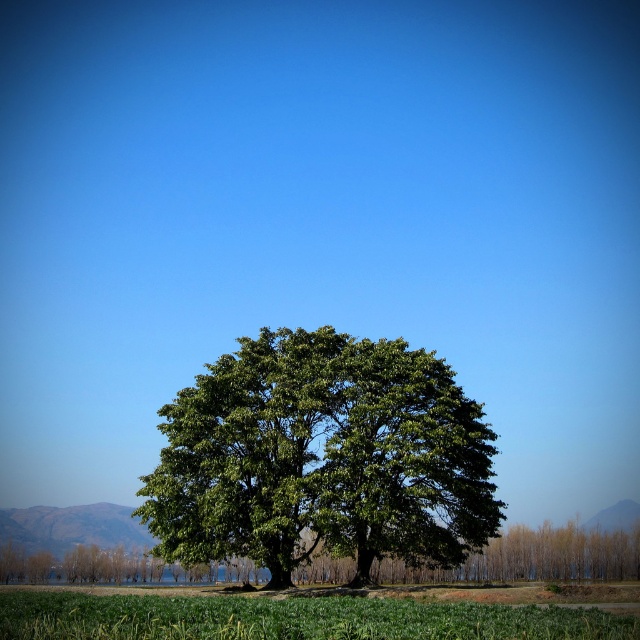
You are standing in the middle of a park and see the green leafy tree at center and the green grass at lower center. Which object is higher in the image?

The green leafy tree at center is higher than the green grass at lower center.

Consider the image. You are standing at the point marked as point (323,458) in the image. What object are you currently standing on?

The point (323,458) is on the green leafy tree at center.

You are standing at the center of the image and want to locate the green leafy tree at center. Which direction should you look to find it?

The green leafy tree at center is located at point coordinates of 0.716 on the x axis and 0.505 on the y axis. Therefore, you should look towards the right side of the image since the x coordinate is greater than 0.5, indicating it is positioned to the right of the center point.